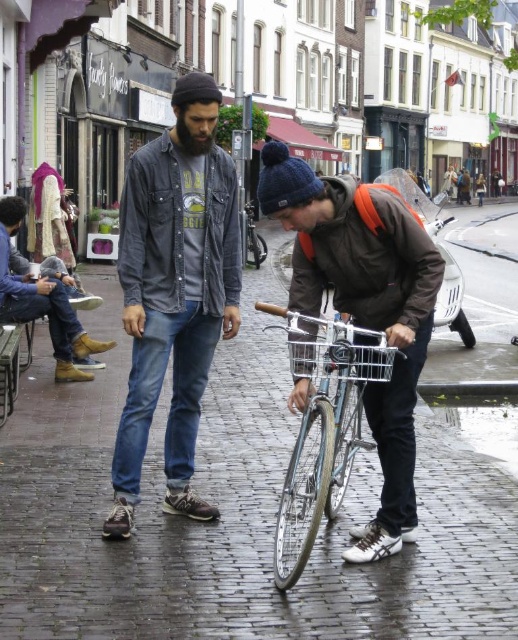
You are a pedestrian trying to cross the street where the denim shirt at center and leather boots at lower left are located. Which object should you avoid stepping on to stay safe?

You should avoid stepping on the leather boots at lower left because the denim shirt at center is in front of them, meaning the boots are closer to the street and might be in a dangerous area.